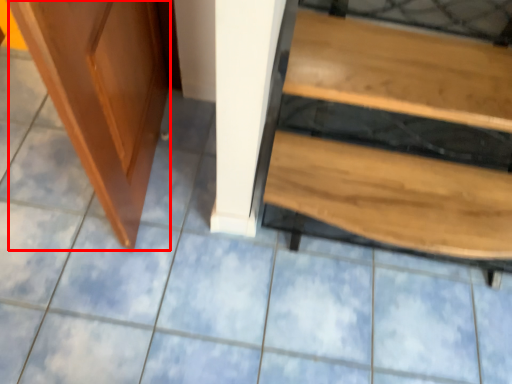
Question: From the image, what is the correct spatial relationship of screen door (annotated by the red box) in relation to furniture?

Choices:
 (A) left
 (B) right

Answer: (A)